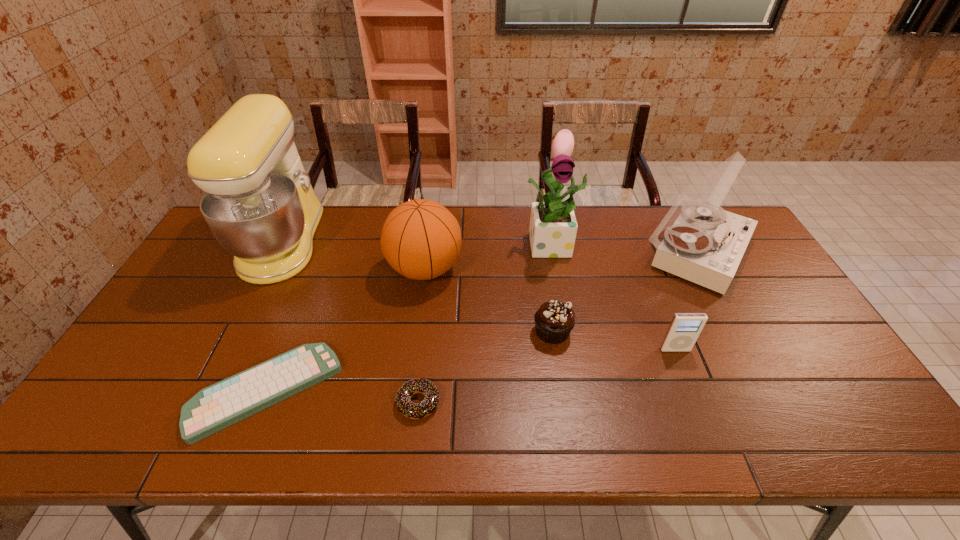
Where is `doughnut that is at the near edge`? This screenshot has height=540, width=960. doughnut that is at the near edge is located at coordinates point(410,410).

Identify the location of computer keyboard positioned at the near edge. The height and width of the screenshot is (540, 960). (218, 406).

Where is `object that is positioned at the left edge`? object that is positioned at the left edge is located at coordinates (259, 203).

The width and height of the screenshot is (960, 540). In order to click on object that is at the right edge in this screenshot , I will do `click(703, 243)`.

Where is `object located in the far left corner section of the desktop`? The image size is (960, 540). object located in the far left corner section of the desktop is located at coordinates (259, 203).

The image size is (960, 540). In order to click on object present at the far right corner in this screenshot , I will do `click(703, 243)`.

Find the location of a particular element. free region at the far edge of the desktop is located at coordinates (607, 228).

What are the coordinates of `free space at the near edge of the desktop` in the screenshot? It's located at (589, 436).

The width and height of the screenshot is (960, 540). Identify the location of vacant space at the left edge of the desktop. (179, 383).

The image size is (960, 540). In order to click on vacant space at the right edge of the desktop in this screenshot , I will do `click(759, 269)`.